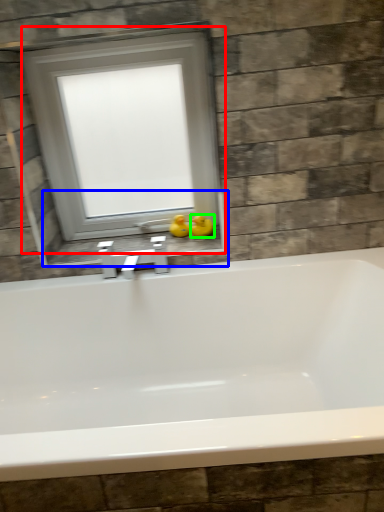
Question: Which object is positioned closest to window (highlighted by a red box)? Select from window sill (highlighted by a blue box) and duck (highlighted by a green box).

Choices:
 (A) window sill
 (B) duck

Answer: (A)